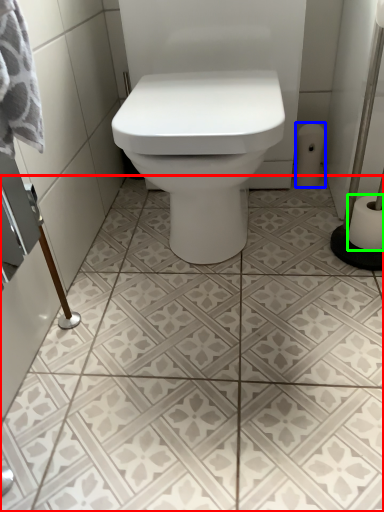
Question: Estimate the real-world distances between objects in this image. Which object is closer to ceramic tile (highlighted by a red box), toilet paper (highlighted by a blue box) or toilet paper (highlighted by a green box)?

Choices:
 (A) toilet paper
 (B) toilet paper

Answer: (B)